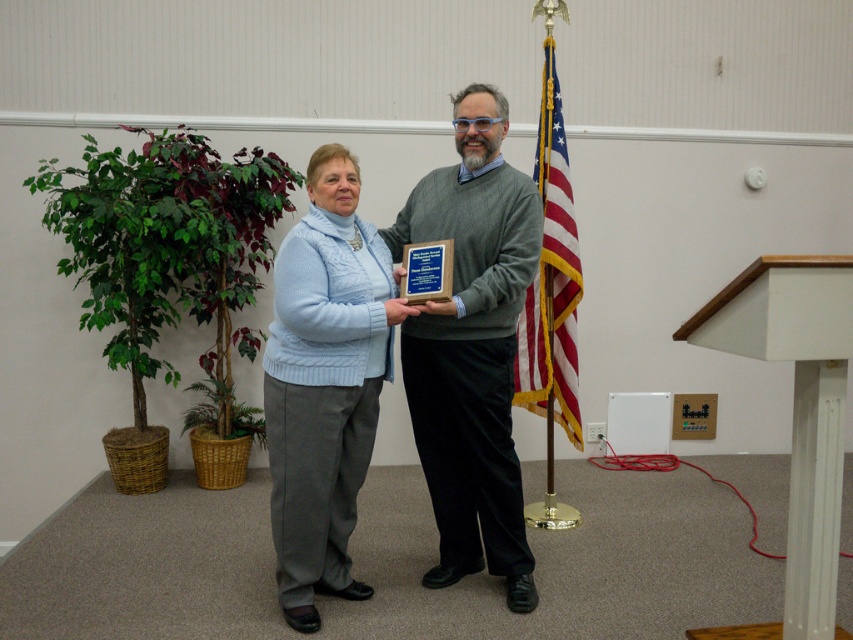
Question: Estimate the real-world distances between objects in this image. Which object is farther from the american flag at center?

Choices:
 (A) matte gray sweater at center
 (B) white glossy podium at center

Answer: (B)

Question: Estimate the real-world distances between objects in this image. Which object is farther from the american flag at center?

Choices:
 (A) light blue sweater at center
 (B) white glossy podium at center

Answer: (B)

Question: Considering the real-world distances, which object is farthest from the matte gray sweater at center?

Choices:
 (A) american flag at center
 (B) light blue sweater at center
 (C) white glossy podium at center

Answer: (A)

Question: Where is light blue sweater at center located in relation to white glossy podium at center in the image?

Choices:
 (A) right
 (B) left

Answer: (B)

Question: Is white glossy podium at center wider than american flag at center?

Choices:
 (A) yes
 (B) no

Answer: (A)

Question: From the image, what is the correct spatial relationship of matte gray sweater at center in relation to light blue sweater at center?

Choices:
 (A) right
 (B) left

Answer: (A)